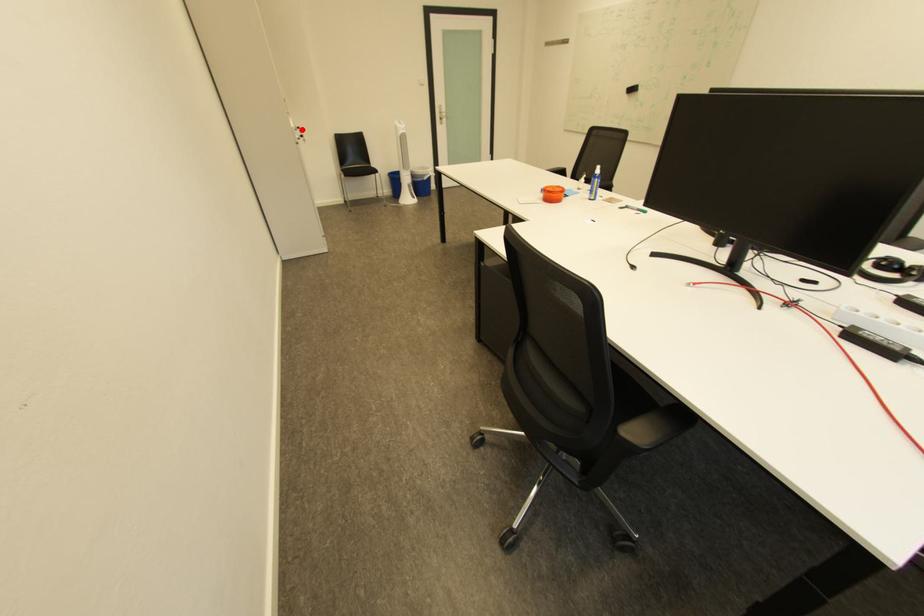
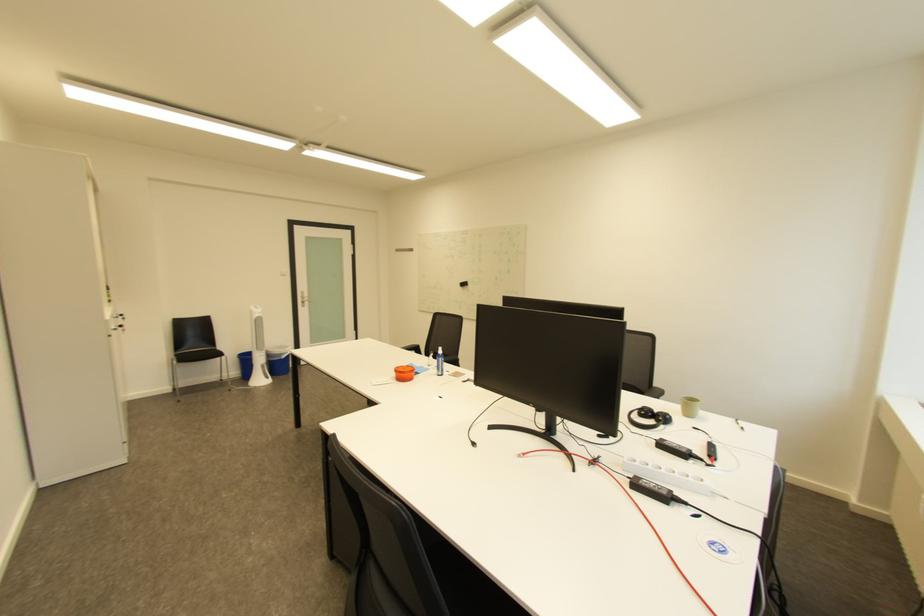
In the second image, find the point that corresponds to the highlighted location in the first image.

(116, 322)